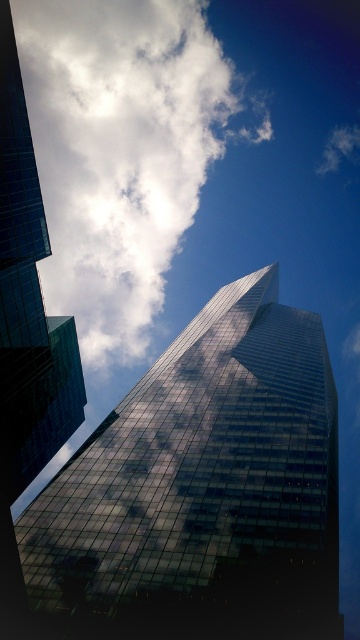
Question: Can you confirm if white fluffy cloud at upper center is wider than glassy reflective skyscraper at left?

Choices:
 (A) no
 (B) yes

Answer: (B)

Question: Which is farther from the white fluffy cloud at upper center?

Choices:
 (A) glassy reflective skyscraper at left
 (B) reflective glass skyscraper at center

Answer: (A)

Question: Which of these objects is positioned farthest from the white fluffy cloud at upper center?

Choices:
 (A) reflective glass skyscraper at center
 (B) glassy reflective skyscraper at left

Answer: (B)

Question: Is reflective glass skyscraper at center to the left of glassy reflective skyscraper at left from the viewer's perspective?

Choices:
 (A) yes
 (B) no

Answer: (B)

Question: Which point appears farthest from the camera in this image?

Choices:
 (A) (135, 563)
 (B) (29, 410)
 (C) (61, 81)

Answer: (C)

Question: Can you confirm if reflective glass skyscraper at center is wider than glassy reflective skyscraper at left?

Choices:
 (A) no
 (B) yes

Answer: (B)